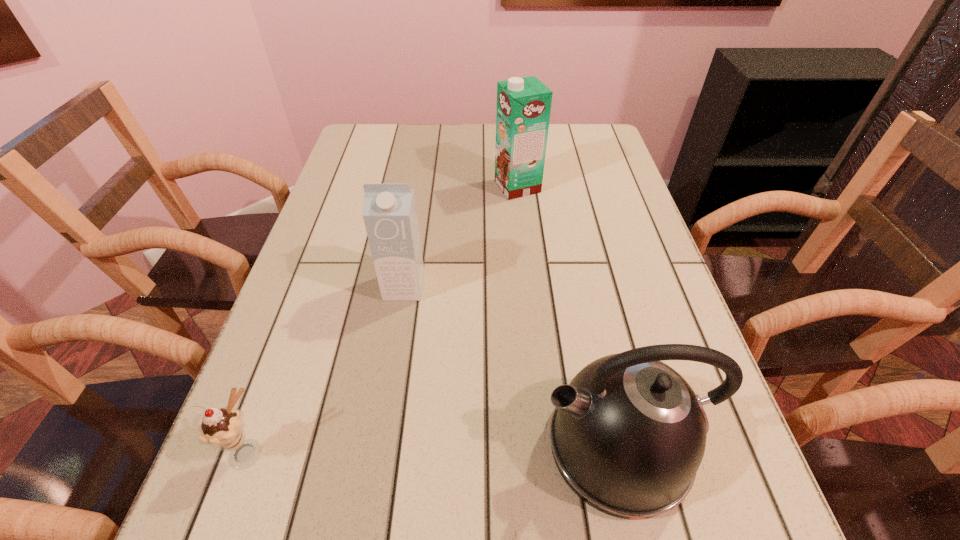
Identify the location of the farther carton. (523, 110).

Image resolution: width=960 pixels, height=540 pixels. I want to click on the right carton, so click(523, 110).

The image size is (960, 540). I want to click on kettle, so click(x=628, y=434).

Locate an element on the screen. This screenshot has width=960, height=540. the third nearest object is located at coordinates (389, 211).

Identify the location of the nearer carton. The width and height of the screenshot is (960, 540). (389, 211).

At what (x,y) coordinates should I click in order to perform the action: click on the shortest object. Please return your answer as a coordinate pair (x, y). This screenshot has height=540, width=960. Looking at the image, I should click on (223, 428).

Locate an element on the screen. icecream is located at coordinates (223, 428).

At what (x,y) coordinates should I click in order to perform the action: click on vacant area located on the front of the right carton. Please return your answer as a coordinate pair (x, y). This screenshot has width=960, height=540. Looking at the image, I should click on (526, 267).

This screenshot has width=960, height=540. I want to click on vacant space situated 0.240m on the spout of the kettle, so click(390, 446).

Image resolution: width=960 pixels, height=540 pixels. In order to click on free space located 0.280m on the spout of the kettle in this screenshot , I will do `click(365, 446)`.